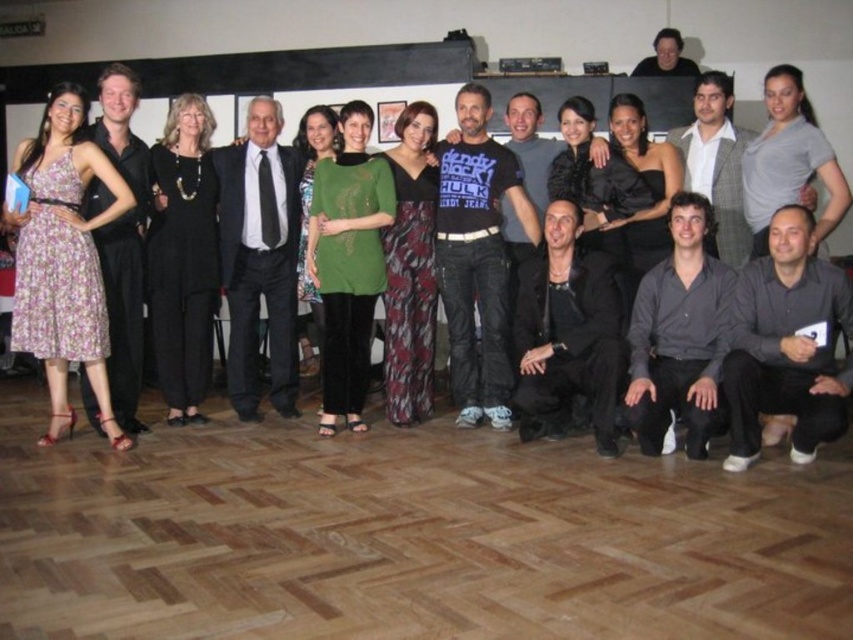
Question: Can you confirm if printed fabric dress at center is positioned below black satin suit at left?

Choices:
 (A) no
 (B) yes

Answer: (B)

Question: Does green jersey at center have a lesser width compared to gray textured blazer at upper right?

Choices:
 (A) yes
 (B) no

Answer: (B)

Question: Is black cotton t-shirt at center smaller than black leather jacket at lower center?

Choices:
 (A) yes
 (B) no

Answer: (B)

Question: Among these objects, which one is farthest from the camera?

Choices:
 (A) black satin suit at left
 (B) gray matte dress at upper right

Answer: (A)

Question: Considering the real-world distances, which object is closest to the black satin suit at center?

Choices:
 (A) gray matte shirt at lower right
 (B) green matte dress at center

Answer: (B)

Question: Which object is the farthest from the black cotton t-shirt at center?

Choices:
 (A) gray matte shirt at lower right
 (B) black satin suit at left
 (C) green jersey at center

Answer: (B)